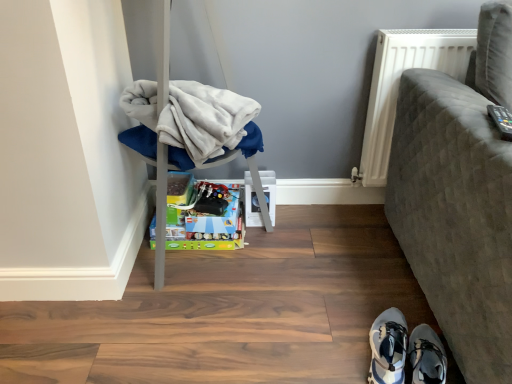
Question: Is point (229, 127) closer or farther from the camera than point (219, 195)?

Choices:
 (A) farther
 (B) closer

Answer: (B)

Question: From a real-world perspective, relative to shiny metallic toy at center, is white fleece blanket at left vertically above or below?

Choices:
 (A) below
 (B) above

Answer: (B)

Question: Which object is positioned farthest from the white fleece blanket at left?

Choices:
 (A) light blue fabric shoe at lower right, the first footwear viewed from the left
 (B) shiny metallic toy at center
 (C) textured gray sofa at right, which is counted as the second furniture, starting from the left
 (D) white synthetic sneakers at lower right, the second footwear positioned from the left
 (E) white textured radiator at upper right

Answer: (D)

Question: Estimate the real-world distances between objects in this image. Which object is closer to the white textured radiator at upper right?

Choices:
 (A) soft gray fabric chair at left, placed as the 2th furniture when sorted from right to left
 (B) textured gray sofa at right, the 1th furniture positioned from the right
 (C) white fleece blanket at left
 (D) white synthetic sneakers at lower right, the second footwear positioned from the left
 (E) light blue fabric shoe at lower right, the first footwear viewed from the left

Answer: (B)